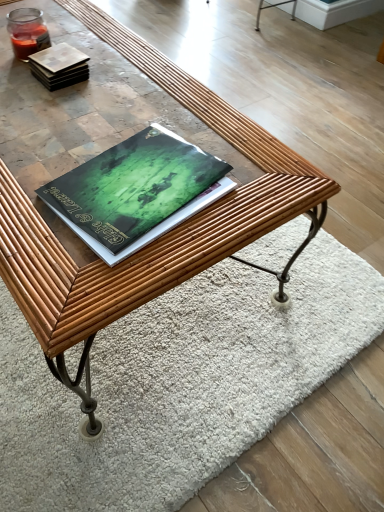
Where is `free location above rug at center (from a real-world perspective)`? Image resolution: width=384 pixels, height=512 pixels. free location above rug at center (from a real-world perspective) is located at coordinates (181, 356).